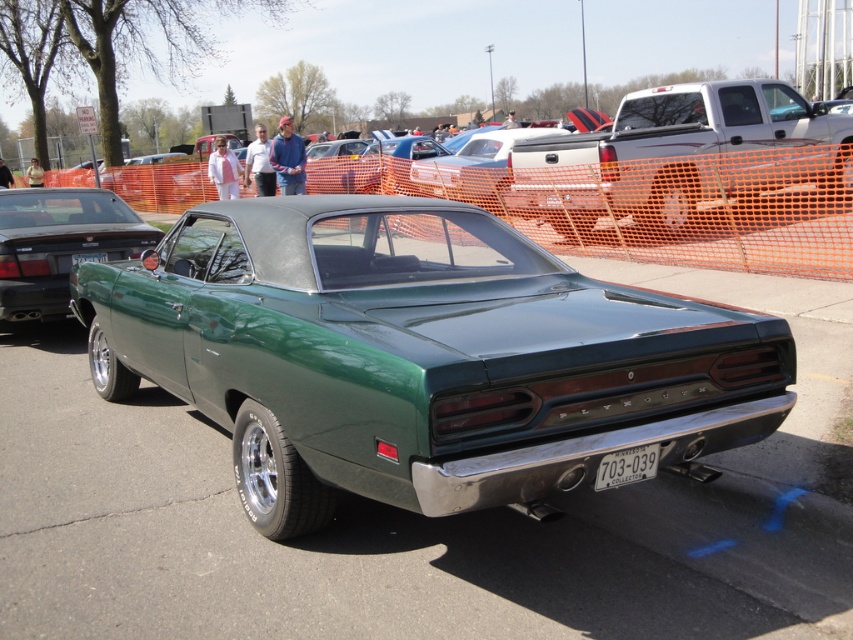
Looking at this image, you are a photographer at the car show and want to take a photo of the green glossy car at center and the white metallic license plate at center. Which object will appear larger in the photo?

The green glossy car at center will appear larger in the photo because it is closer to the viewer than the white metallic license plate at center.

You are a photographer at a car exhibition and need to capture a closeup shot of the white metallic license plate at center while also ensuring the green matte car at center is visible in the background. Given the spatial relationship between them, will the license plate be fully visible in the frame if you focus on the car?

The green matte car at center is wider than the white metallic license plate at center, so focusing on the car might cause the license plate to be partially obscured unless the camera angle is adjusted to accommodate the car and license plate simultaneously.